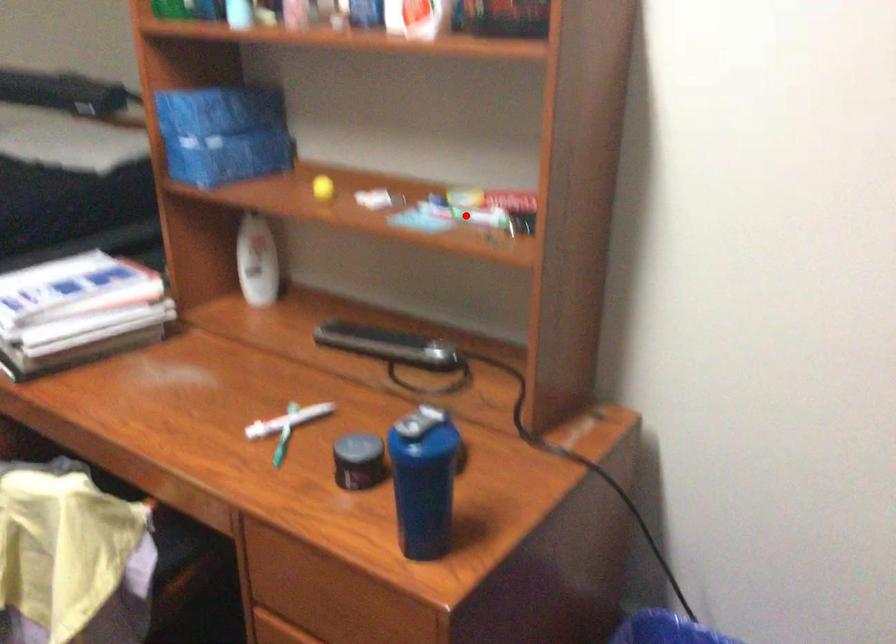
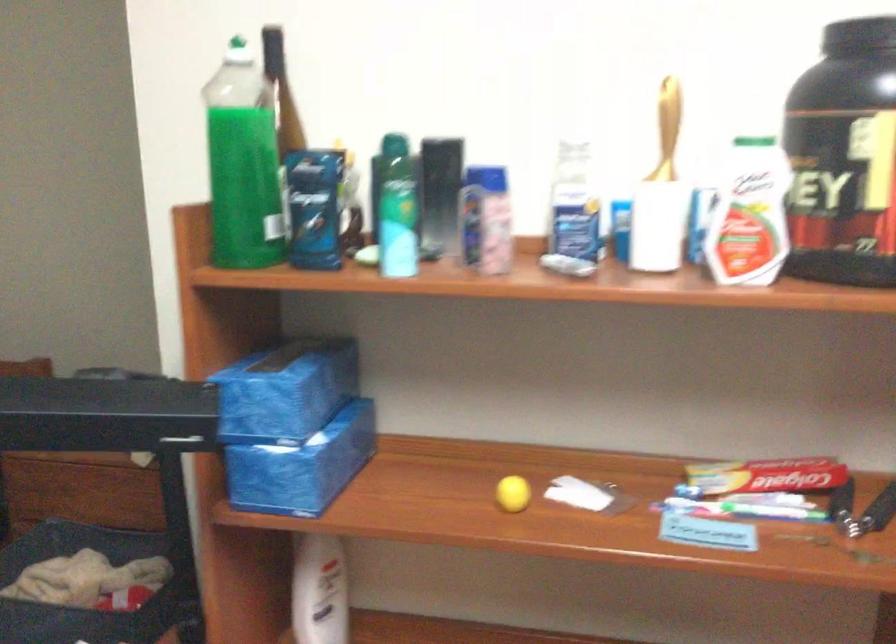
The point at the highlighted location is marked in the first image. Where is the corresponding point in the second image?

(743, 509)